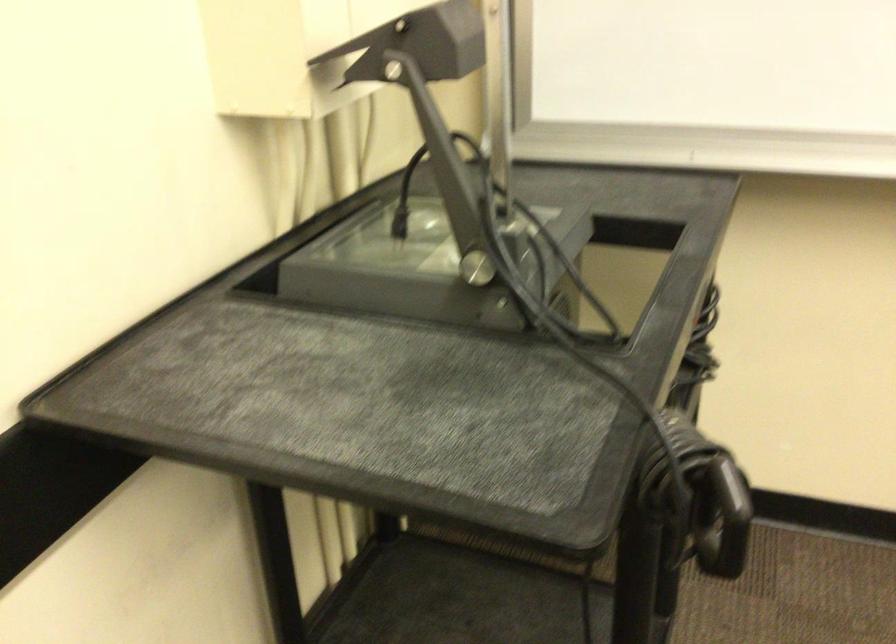
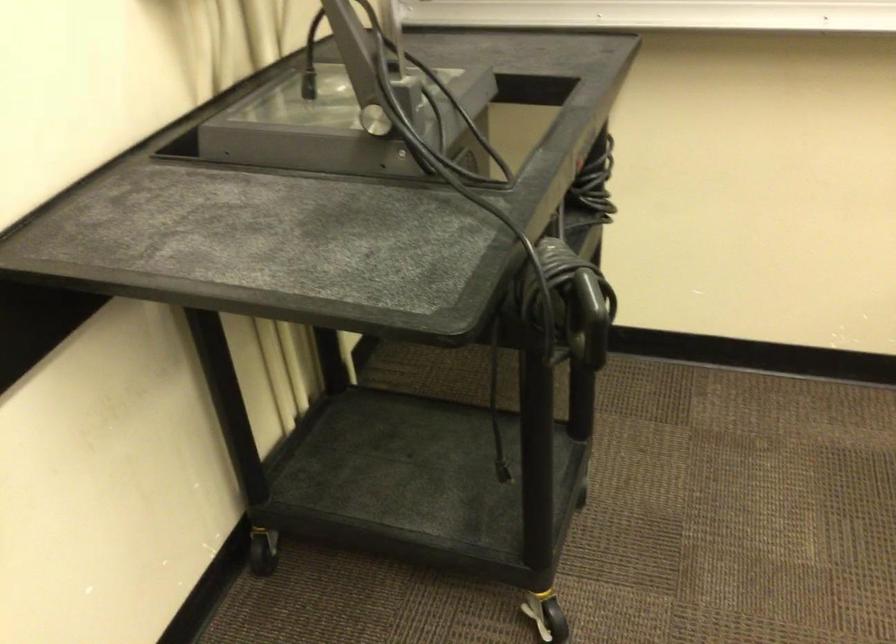
Question: The images are taken continuously from a first-person perspective. In which direction is your viewpoint rotating?

Choices:
 (A) Left
 (B) Right
 (C) Up
 (D) Down

Answer: (D)